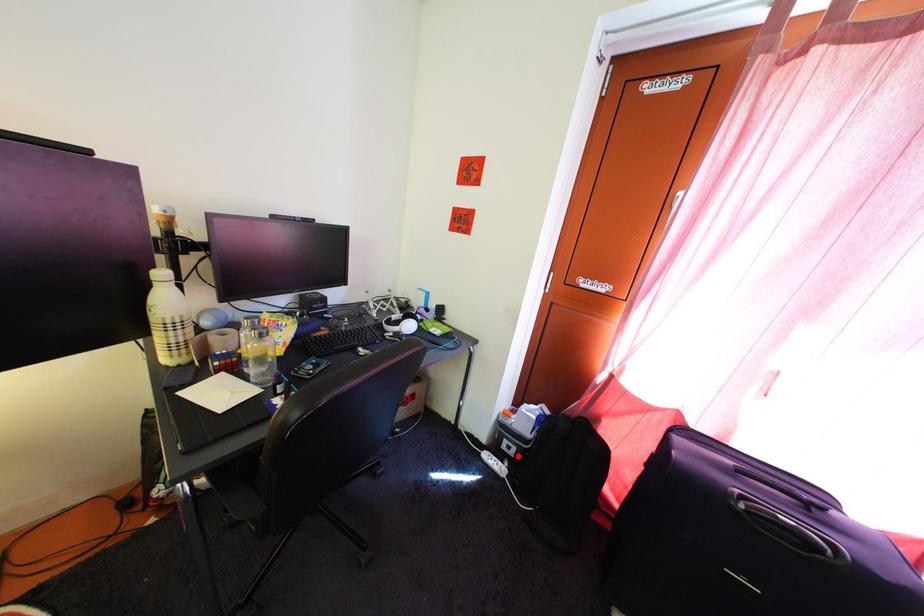
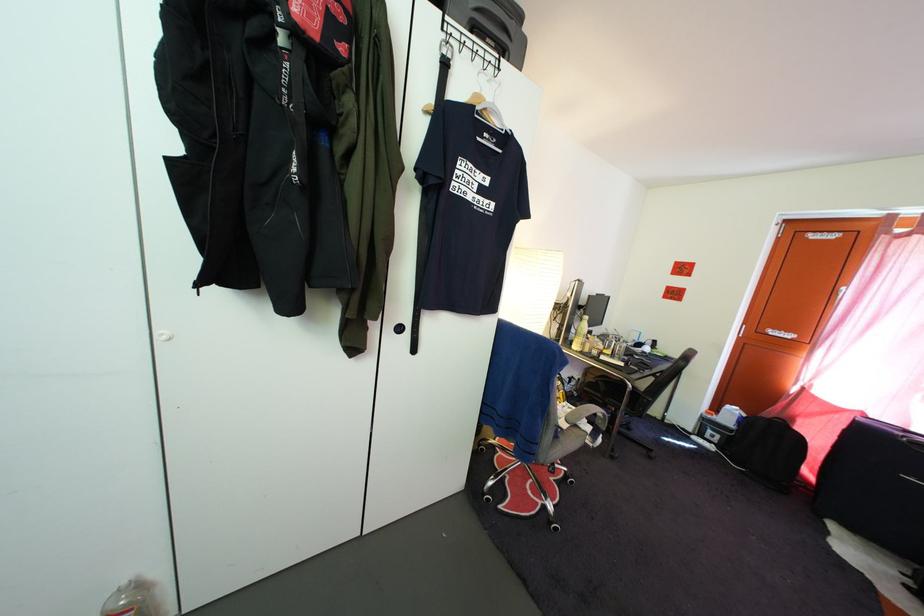
In the second image, find the point that corresponds to the highlighted location in the first image.

(721, 445)